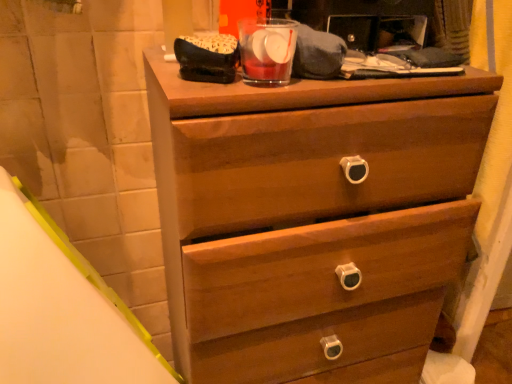
This screenshot has height=384, width=512. Find the location of `transparent glass at upper center`. transparent glass at upper center is located at coordinates (267, 50).

This screenshot has width=512, height=384. Describe the element at coordinates (267, 50) in the screenshot. I see `transparent glass at upper center` at that location.

Where is `wooden chest of drawers at center`? wooden chest of drawers at center is located at coordinates (313, 221).

The width and height of the screenshot is (512, 384). Describe the element at coordinates (313, 221) in the screenshot. I see `wooden chest of drawers at center` at that location.

This screenshot has height=384, width=512. I want to click on transparent glass at upper center, so click(267, 50).

Does transparent glass at upper center appear on the right side of wooden chest of drawers at center?

Incorrect, transparent glass at upper center is not on the right side of wooden chest of drawers at center.

Based on the photo, is transparent glass at upper center behind wooden chest of drawers at center?

Yes, the depth of transparent glass at upper center is greater than that of wooden chest of drawers at center.

Is point (243, 72) closer or farther from the camera than point (240, 372)?

Point (243, 72) is closer to the camera than point (240, 372).

From the image's perspective, is transparent glass at upper center on wooden chest of drawers at center?

Yes, from the image's perspective, transparent glass at upper center is over wooden chest of drawers at center.

In the scene shown: From a real-world perspective, between transparent glass at upper center and wooden chest of drawers at center, who is vertically higher?

In real-world perspective, transparent glass at upper center is above.

Which of these two, transparent glass at upper center or wooden chest of drawers at center, is wider?

wooden chest of drawers at center.

Considering the sizes of objects transparent glass at upper center and wooden chest of drawers at center in the image provided, who is taller, transparent glass at upper center or wooden chest of drawers at center?

wooden chest of drawers at center.

Does transparent glass at upper center have a larger size compared to wooden chest of drawers at center?

Incorrect, transparent glass at upper center is not larger than wooden chest of drawers at center.

Is transparent glass at upper center situated inside wooden chest of drawers at center or outside?

transparent glass at upper center exists outside the volume of wooden chest of drawers at center.

Consider the image. Are transparent glass at upper center and wooden chest of drawers at center located far from each other?

That's not correct — transparent glass at upper center is a little close to wooden chest of drawers at center.

Is transparent glass at upper center positioned with its back to wooden chest of drawers at center?

transparent glass at upper center does not have its back to wooden chest of drawers at center.

Can you tell me how much transparent glass at upper center and wooden chest of drawers at center differ in facing direction?

There is a 0.645-degree angle between the facing directions of transparent glass at upper center and wooden chest of drawers at center.

I want to click on the chest of drawers located below the transparent glass at upper center (from the image's perspective), so click(313, 221).

Looking at this image, considering the relative positions of wooden chest of drawers at center and transparent glass at upper center in the image provided, is wooden chest of drawers at center to the left of transparent glass at upper center from the viewer's perspective?

No, wooden chest of drawers at center is not to the left of transparent glass at upper center.

Based on the photo, relative to transparent glass at upper center, is wooden chest of drawers at center in front or behind?

Clearly, wooden chest of drawers at center is in front of transparent glass at upper center.

Does point (460, 139) lie in front of point (286, 30)?

No, (460, 139) is further to viewer.

From the image's perspective, is wooden chest of drawers at center positioned above or below transparent glass at upper center?

wooden chest of drawers at center is situated lower than transparent glass at upper center in the image.

From a real-world perspective, which is physically above, wooden chest of drawers at center or transparent glass at upper center?

transparent glass at upper center.

Considering the sizes of objects wooden chest of drawers at center and transparent glass at upper center in the image provided, who is wider, wooden chest of drawers at center or transparent glass at upper center?

Wider between the two is wooden chest of drawers at center.

Is wooden chest of drawers at center taller or shorter than transparent glass at upper center?

wooden chest of drawers at center is taller than transparent glass at upper center.

Based on their sizes in the image, would you say wooden chest of drawers at center is bigger or smaller than transparent glass at upper center?

Considering their sizes, wooden chest of drawers at center takes up more space than transparent glass at upper center.

Is wooden chest of drawers at center inside the boundaries of transparent glass at upper center, or outside?

wooden chest of drawers at center is spatially situated outside transparent glass at upper center.

Would you consider wooden chest of drawers at center to be distant from transparent glass at upper center?

No, wooden chest of drawers at center is not far away from transparent glass at upper center.

Is wooden chest of drawers at center oriented towards transparent glass at upper center?

No, wooden chest of drawers at center is not oriented towards transparent glass at upper center.

How many degrees apart are the facing directions of wooden chest of drawers at center and transparent glass at upper center?

wooden chest of drawers at center and transparent glass at upper center are facing 0.645 degrees away from each other.

You are a GUI agent. You are given a task and a screenshot of the screen. Output one action in this format:
    pyautogui.click(x=<x>, y=<y>)
    Task: Click on the chest of drawers that is on the right side of transparent glass at upper center
    This screenshot has width=512, height=384.
    Given the screenshot: What is the action you would take?
    pyautogui.click(x=313, y=221)

You are a GUI agent. You are given a task and a screenshot of the screen. Output one action in this format:
    pyautogui.click(x=<x>, y=<y>)
    Task: Click on the beverage behind the wooden chest of drawers at center
    The height and width of the screenshot is (384, 512).
    Given the screenshot: What is the action you would take?
    pyautogui.click(x=267, y=50)

Locate an element on the screen. The height and width of the screenshot is (384, 512). chest of drawers on the right of transparent glass at upper center is located at coordinates (313, 221).